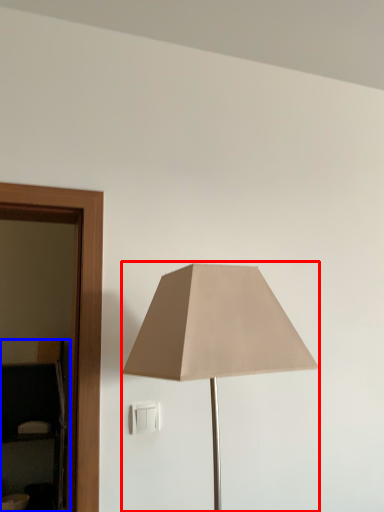
Question: Which object is further to the camera taking this photo, lamp (highlighted by a red box) or dresser (highlighted by a blue box)?

Choices:
 (A) lamp
 (B) dresser

Answer: (B)